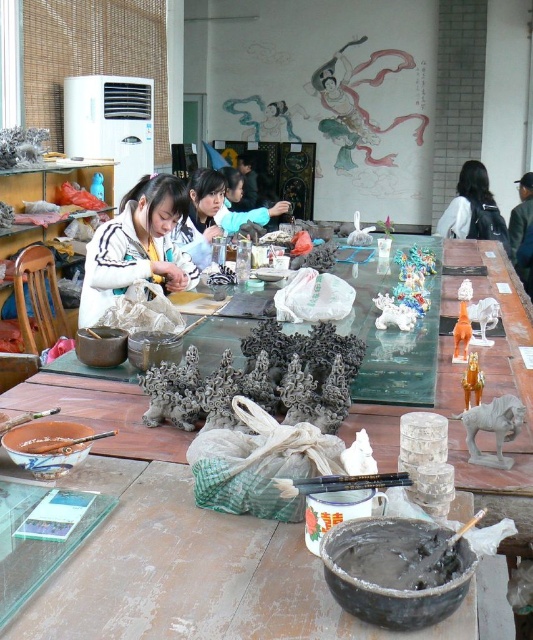
Question: Which point appears farthest from the camera in this image?

Choices:
 (A) (164, 224)
 (B) (391, 536)
 (C) (456, 220)

Answer: (C)

Question: Estimate the real-world distances between objects in this image. Which object is farther from the smooth gray paste at lower center?

Choices:
 (A) black fabric bag at right
 (B) white matte jacket at center

Answer: (A)

Question: Estimate the real-world distances between objects in this image. Which object is farther from the white matte jacket at center?

Choices:
 (A) smooth gray paste at lower center
 (B) black fabric bag at right

Answer: (B)

Question: Does smooth gray paste at lower center have a lesser width compared to black fabric bag at right?

Choices:
 (A) yes
 (B) no

Answer: (A)

Question: Does white matte jacket at center have a smaller size compared to black fabric bag at right?

Choices:
 (A) yes
 (B) no

Answer: (A)

Question: Where is smooth gray paste at lower center located in relation to black fabric bag at right in the image?

Choices:
 (A) left
 (B) right

Answer: (A)